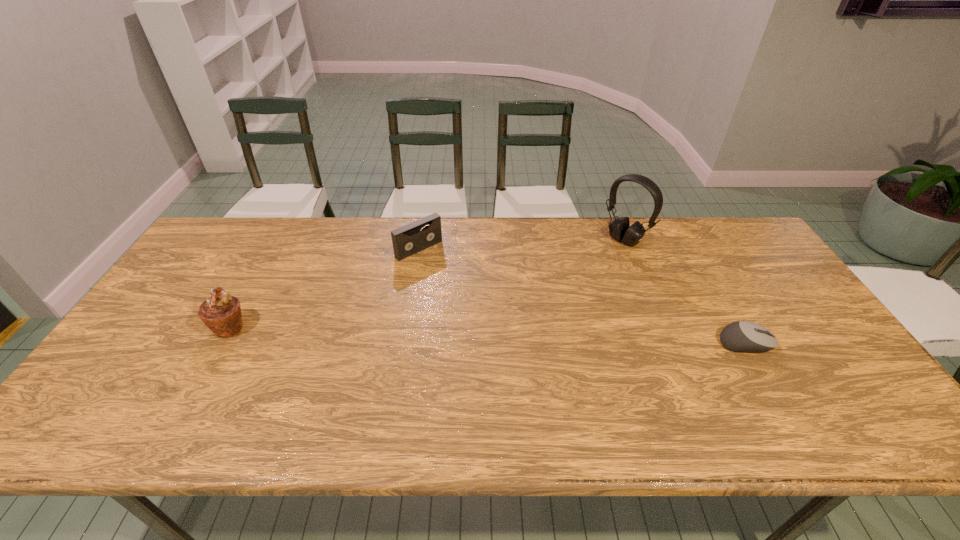
You are a GUI agent. You are given a task and a screenshot of the screen. Output one action in this format:
    pyautogui.click(x=<x>, y=<y>)
    Task: Click on the vacant region at the near edge of the desktop
    
    Given the screenshot: What is the action you would take?
    pyautogui.click(x=358, y=393)

Locate an element on the screen. The width and height of the screenshot is (960, 540). blank space at the right edge of the desktop is located at coordinates (776, 301).

Where is `vacant space at the far left corner`? vacant space at the far left corner is located at coordinates (234, 238).

The width and height of the screenshot is (960, 540). Identify the location of free space at the near left corner. (161, 387).

Where is `vacant space at the far right corner`? The image size is (960, 540). vacant space at the far right corner is located at coordinates (717, 233).

Locate an element on the screen. The width and height of the screenshot is (960, 540). vacant space at the near right corner of the desktop is located at coordinates (832, 376).

Find the location of a particular element. This screenshot has height=540, width=960. empty space that is in between the leftmost object and the headset is located at coordinates (427, 284).

Identify the location of vacant region between the computer equipment and the third object from left to right. (685, 292).

You are a GUI agent. You are given a task and a screenshot of the screen. Output one action in this format:
    pyautogui.click(x=<x>, y=<y>)
    Task: Click on the free space between the leftmost object and the second object from left to right
    
    Given the screenshot: What is the action you would take?
    pyautogui.click(x=324, y=288)

Image resolution: width=960 pixels, height=540 pixels. Identify the location of vacant space that is in between the shortest object and the third shortest object. (488, 335).